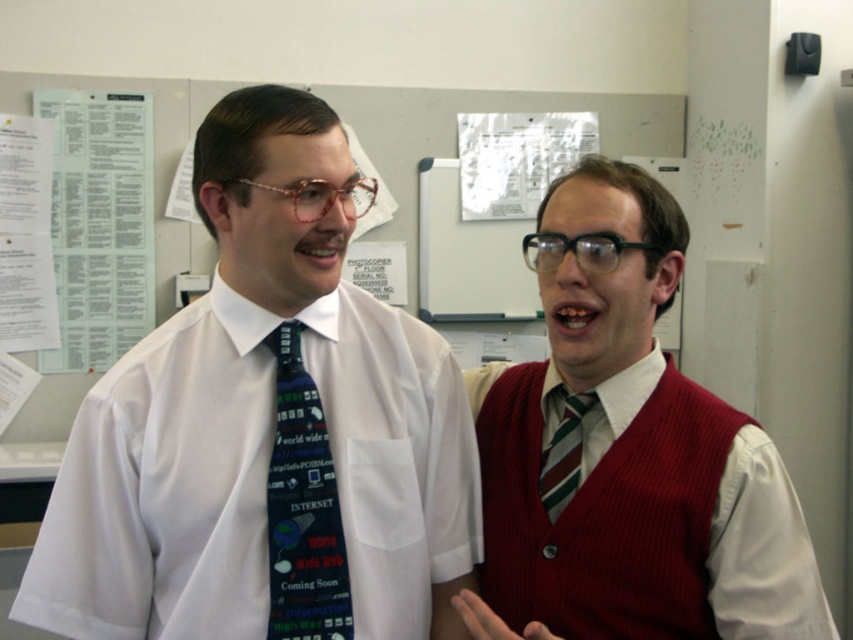
Can you confirm if white paper at upper left is smaller than striped fabric tie at center?

Actually, white paper at upper left might be larger than striped fabric tie at center.

Does white paper at upper left appear on the right side of striped fabric tie at center?

In fact, white paper at upper left is to the left of striped fabric tie at center.

Between point (135, 195) and point (567, 445), which one is positioned behind?

Point (135, 195)

This screenshot has width=853, height=640. In order to click on white paper at upper left in this screenshot , I will do `click(99, 225)`.

Is knitted red vest at center closer to camera compared to striped fabric tie at center?

Yes, knitted red vest at center is closer to the viewer.

Can you confirm if knitted red vest at center is positioned below striped fabric tie at center?

Yes.

Where is `knitted red vest at center`? The width and height of the screenshot is (853, 640). knitted red vest at center is located at coordinates (604, 515).

Based on the photo, is knitted red vest at center above blue fabric tie at center?

No.

Can you confirm if knitted red vest at center is smaller than blue fabric tie at center?

No, knitted red vest at center is not smaller than blue fabric tie at center.

Find the location of a particular element. knitted red vest at center is located at coordinates (604, 515).